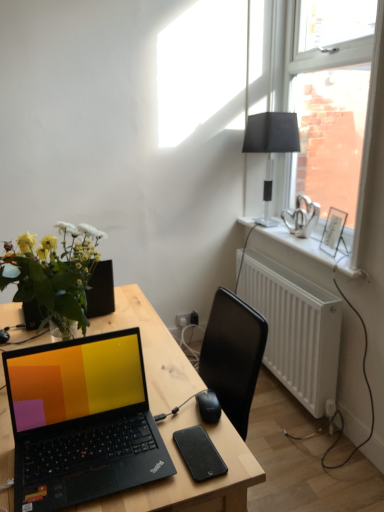
Question: From a real-world perspective, is white plastic radiator at lower right below black wood desk at center?

Choices:
 (A) no
 (B) yes

Answer: (B)

Question: Is white plastic radiator at lower right not inside black wood desk at center?

Choices:
 (A) no
 (B) yes

Answer: (B)

Question: Does white plastic radiator at lower right appear on the right side of black wood desk at center?

Choices:
 (A) no
 (B) yes

Answer: (B)

Question: Does white plastic radiator at lower right touch black wood desk at center?

Choices:
 (A) no
 (B) yes

Answer: (A)

Question: Does white plastic radiator at lower right turn towards black wood desk at center?

Choices:
 (A) no
 (B) yes

Answer: (B)

Question: Is white plastic radiator at lower right wider than black wood desk at center?

Choices:
 (A) no
 (B) yes

Answer: (A)

Question: Would you say black wood desk at center is a long distance from black plastic mouse at center?

Choices:
 (A) yes
 (B) no

Answer: (B)

Question: Does black wood desk at center appear on the right side of black plastic mouse at center?

Choices:
 (A) no
 (B) yes

Answer: (A)

Question: Does black wood desk at center have a lesser width compared to black plastic mouse at center?

Choices:
 (A) no
 (B) yes

Answer: (A)

Question: Is black wood desk at center turned away from black plastic mouse at center?

Choices:
 (A) yes
 (B) no

Answer: (B)

Question: From the image's perspective, is black wood desk at center located beneath black plastic mouse at center?

Choices:
 (A) yes
 (B) no

Answer: (A)

Question: Does black wood desk at center have a lesser height compared to black plastic mouse at center?

Choices:
 (A) yes
 (B) no

Answer: (B)

Question: Is black plastic mouse at center inside black matte lampshade at upper right?

Choices:
 (A) yes
 (B) no

Answer: (B)